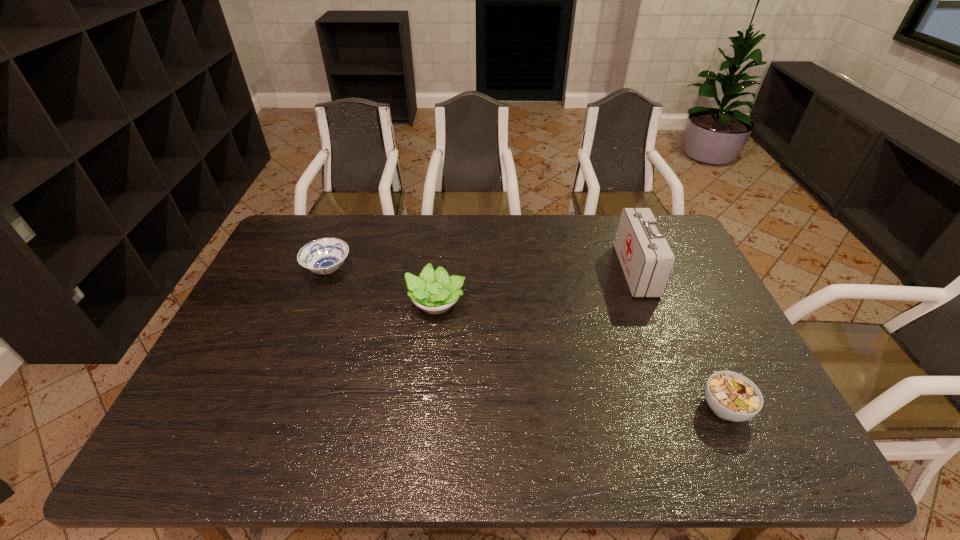
Identify the location of object present at the far right corner. Image resolution: width=960 pixels, height=540 pixels. (647, 260).

Identify the location of object located in the near right corner section of the desktop. This screenshot has height=540, width=960. (731, 396).

Identify the location of vacant space at the far edge of the desktop. tap(370, 228).

Locate an element on the screen. The width and height of the screenshot is (960, 540). vacant space at the near edge of the desktop is located at coordinates (477, 464).

Where is `vacant space at the left edge`? vacant space at the left edge is located at coordinates (250, 292).

Identify the location of free region at the right edge of the desktop. (711, 343).

In the image, there is a desktop. Where is `blank space at the far left corner`? The image size is (960, 540). blank space at the far left corner is located at coordinates (320, 221).

In the image, there is a desktop. At what (x,y) coordinates should I click in order to perform the action: click on free space at the near right corner. Please return your answer as a coordinate pair (x, y). Looking at the image, I should click on (768, 453).

I want to click on free space between the lettuce and the leftmost object, so click(x=382, y=286).

You are a GUI agent. You are given a task and a screenshot of the screen. Output one action in this format:
    pyautogui.click(x=<x>, y=<y>)
    Task: Click on the blank region between the nearer soup bowl and the second tallest object
    The height and width of the screenshot is (540, 960).
    Given the screenshot: What is the action you would take?
    580,355